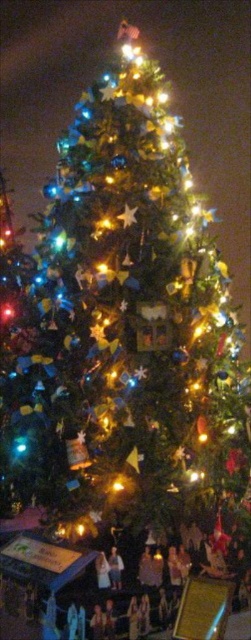
Locate an element on the screen. white cotton shirt at lower center is located at coordinates (114, 568).

Does white cotton shirt at lower center have a lesser width compared to metallic gold star at center?

Indeed, white cotton shirt at lower center has a lesser width compared to metallic gold star at center.

The width and height of the screenshot is (251, 640). What do you see at coordinates (114, 568) in the screenshot?
I see `white cotton shirt at lower center` at bounding box center [114, 568].

The image size is (251, 640). In order to click on white cotton shirt at lower center in this screenshot , I will do `click(114, 568)`.